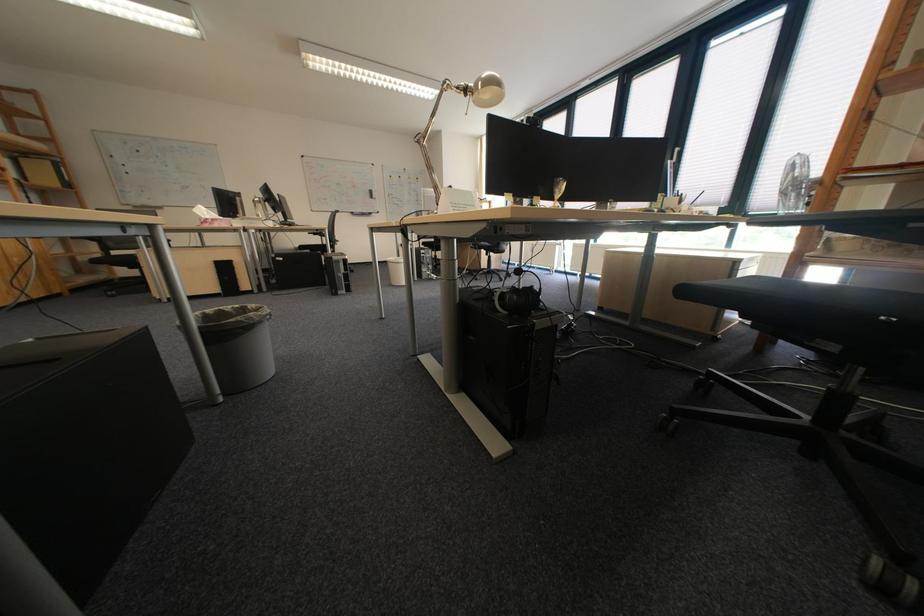
Identify the location of silver lamp head. The height and width of the screenshot is (616, 924). (487, 90).